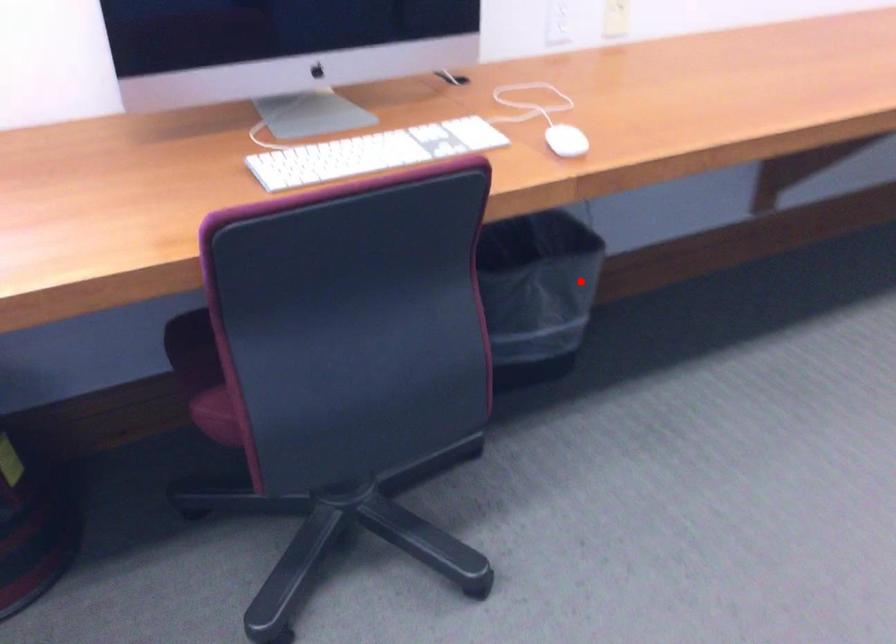
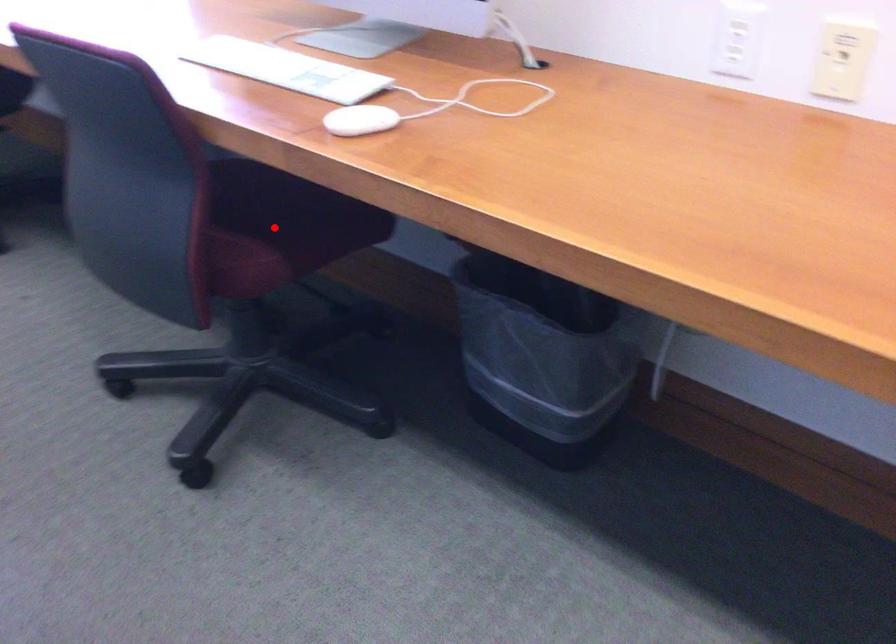
I am providing you with two images of the same scene from different viewpoints. A red point is marked on the first image and another point is marked on the second image. Is the marked point in image1 the same physical position as the marked point in image2?

No